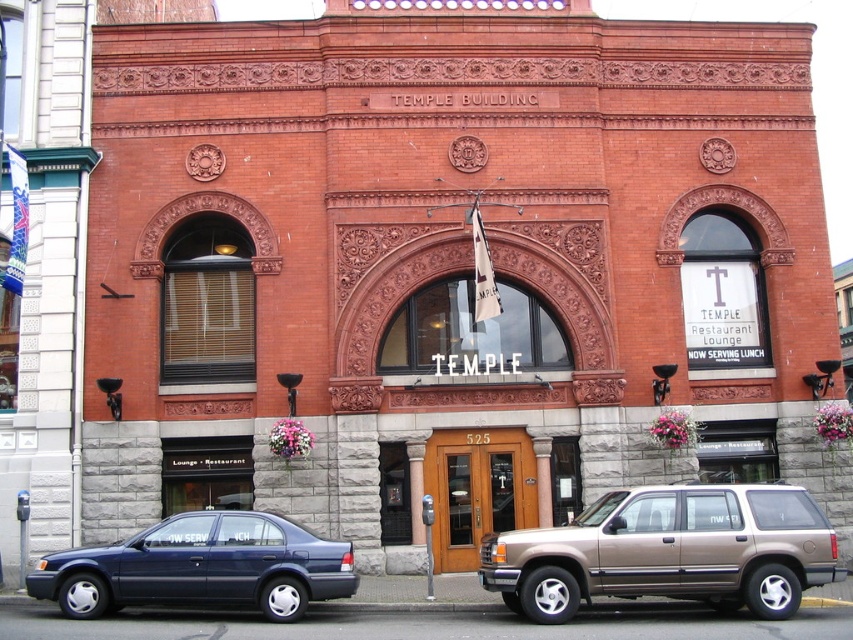
From the picture: You are a delivery driver who needs to park your vehicle in front of the TEMPLE BUILDING. You see a gold metallic suv at center and a matte blue sedan at left. Which vehicle is parked closer to the building entrance?

The gold metallic suv at center is located above the matte blue sedan at left, meaning it is closer to the building entrance.

You are a delivery driver who needs to park your truck between the gold metallic suv at center and the matte blue sedan at left. The truck requires 30 feet of space. Can you fit it there?

The gold metallic suv at center is 33.11 feet from the matte blue sedan at left, so yes, the truck can fit between them as the distance is sufficient for the required 30 feet of space.

You are a delivery driver approaching the TEMPLE BUILDING. You need to park your gold metallic suv at center near the entrance. Is the suv positioned correctly for easy access to the main entrance?

The gold metallic suv at center is located at point (669, 552), which is near the central entrance of the building. Therefore, the suv is positioned correctly for easy access to the main entrance.